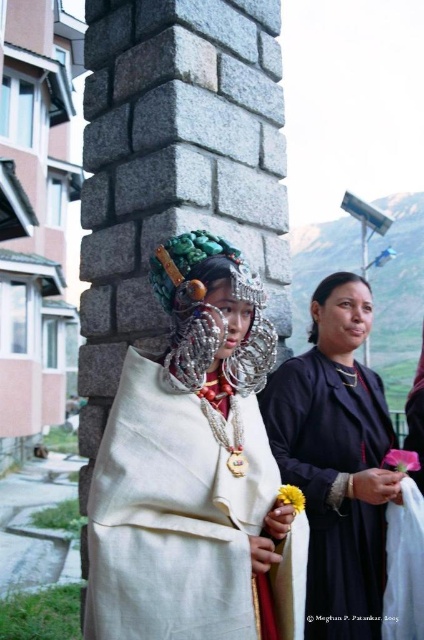
Question: Considering the relative positions of matte black dress at center and silver metallic headdress at center in the image provided, where is matte black dress at center located with respect to silver metallic headdress at center?

Choices:
 (A) left
 (B) right

Answer: (B)

Question: Based on their relative distances, which object is farther from the silver metallic headdress at center?

Choices:
 (A) matte black dress at center
 (B) white fabric at center

Answer: (A)

Question: Which point appears closest to the camera in this image?

Choices:
 (A) (187, 337)
 (B) (170, 314)

Answer: (A)

Question: Does white fabric at center lie behind silver metallic headdress at center?

Choices:
 (A) no
 (B) yes

Answer: (A)

Question: Is white fabric at center further to the viewer compared to silver metallic headdress at center?

Choices:
 (A) yes
 (B) no

Answer: (B)

Question: Which point is farther from the camera taking this photo?

Choices:
 (A) (304, 470)
 (B) (251, 340)

Answer: (A)